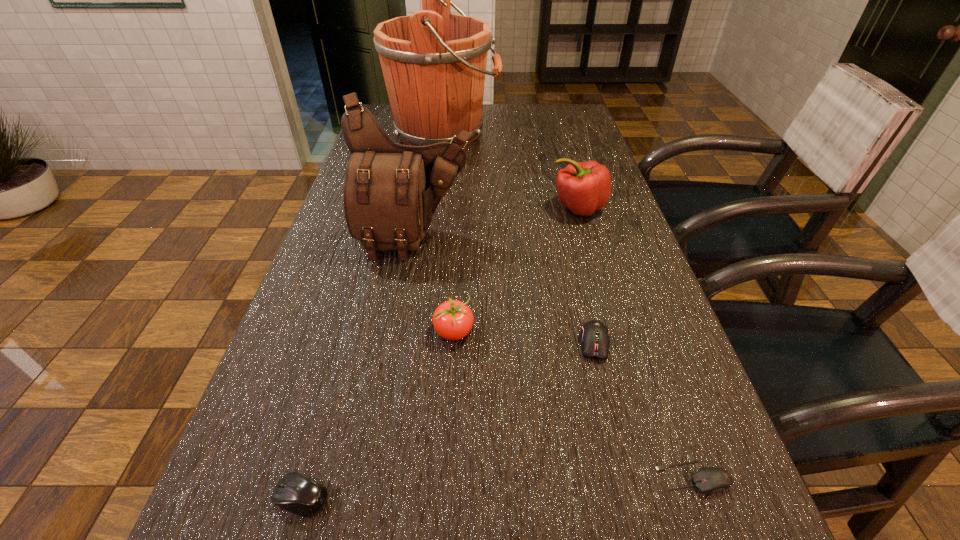
I want to click on free location that satisfies the following two spatial constraints: 1. on the front-facing side of the shortest mouse; 2. on the left side of the shoulder bag, so click(372, 478).